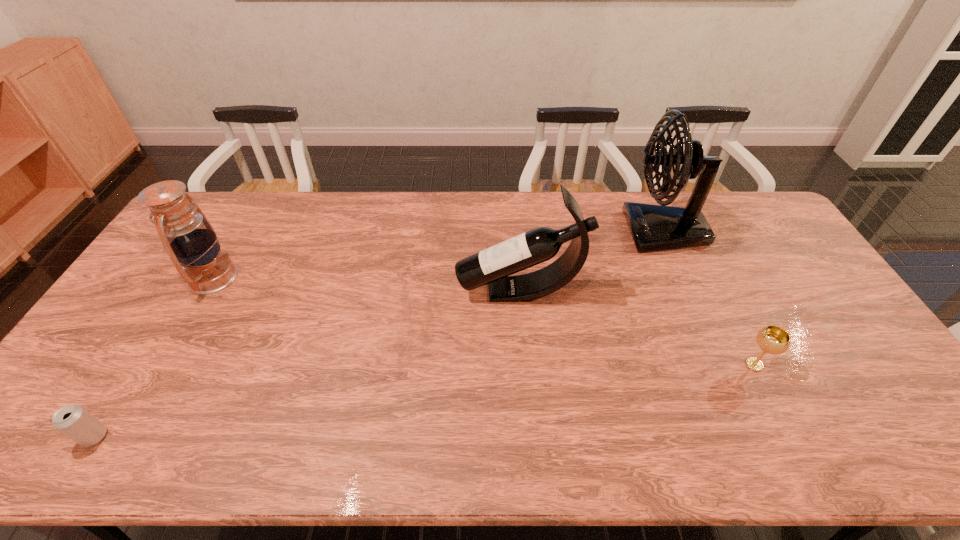
The image size is (960, 540). What are the coordinates of `the tallest object` in the screenshot? It's located at (653, 227).

The height and width of the screenshot is (540, 960). What are the coordinates of `wine bottle` in the screenshot? It's located at [x=494, y=265].

Identify the location of oil lamp. The width and height of the screenshot is (960, 540). (190, 241).

Identify the location of the second nearest object. (772, 339).

The height and width of the screenshot is (540, 960). Find the location of `the fourth tallest object`. the fourth tallest object is located at coordinates (772, 339).

Find the location of a particular element. The height and width of the screenshot is (540, 960). the shortest object is located at coordinates (76, 423).

The image size is (960, 540). Find the location of `beer can`. beer can is located at coordinates (76, 423).

Locate an element on the screen. This screenshot has height=540, width=960. free space located 0.160m in front of the fan to blow air is located at coordinates (577, 231).

This screenshot has width=960, height=540. I want to click on vacant space positioned 0.080m in front of the fan to blow air, so click(x=600, y=231).

In order to click on vacant space located in front of the fan to blow air in this screenshot , I will do `click(519, 231)`.